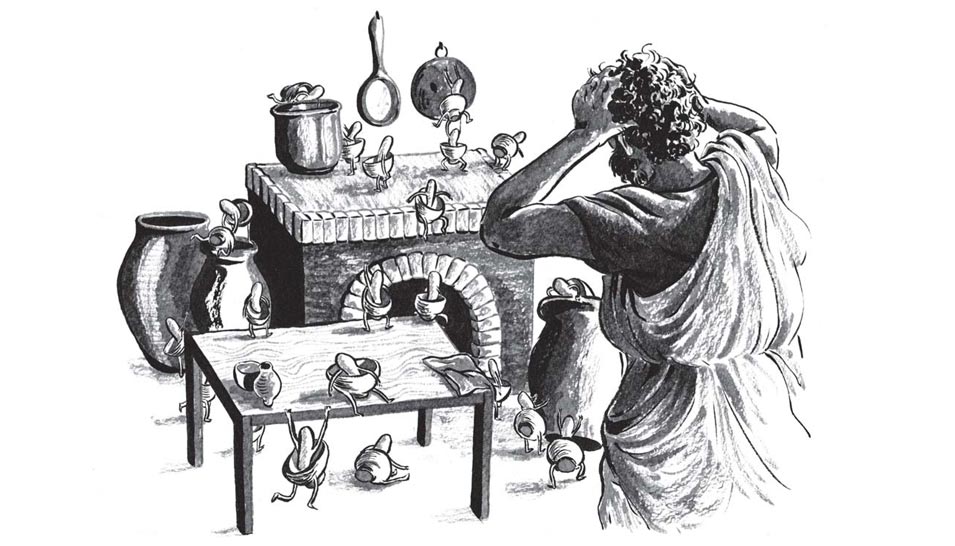
Find the location of `bowl`. bowl is located at coordinates (356, 382).